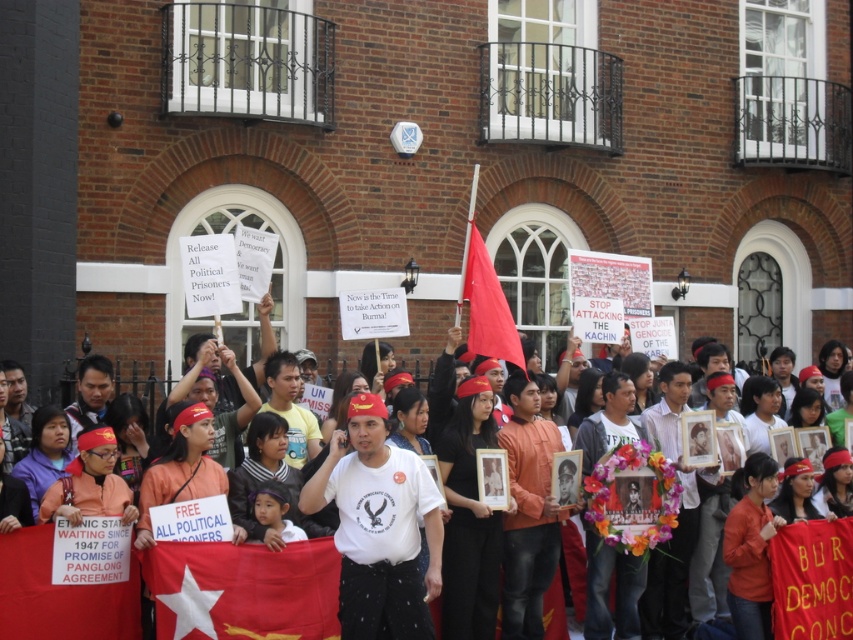
Question: Which of the following is the closest to the observer?

Choices:
 (A) (28, 618)
 (B) (343, 618)
 (C) (146, 564)

Answer: (A)

Question: Is white cotton shirt at center to the left of red fabric flag at center from the viewer's perspective?

Choices:
 (A) yes
 (B) no

Answer: (B)

Question: Can you confirm if white cotton t-shirt at center is smaller than red fabric flag at center?

Choices:
 (A) no
 (B) yes

Answer: (A)

Question: Which point is farther to the camera?

Choices:
 (A) (244, 612)
 (B) (492, 276)

Answer: (B)

Question: Can you confirm if white cotton shirt at center is positioned below white cotton t-shirt at center?

Choices:
 (A) yes
 (B) no

Answer: (A)

Question: Which of the following is the closest to the observer?

Choices:
 (A) (157, 596)
 (B) (35, 552)
 (C) (485, 269)
 (D) (354, 496)

Answer: (B)